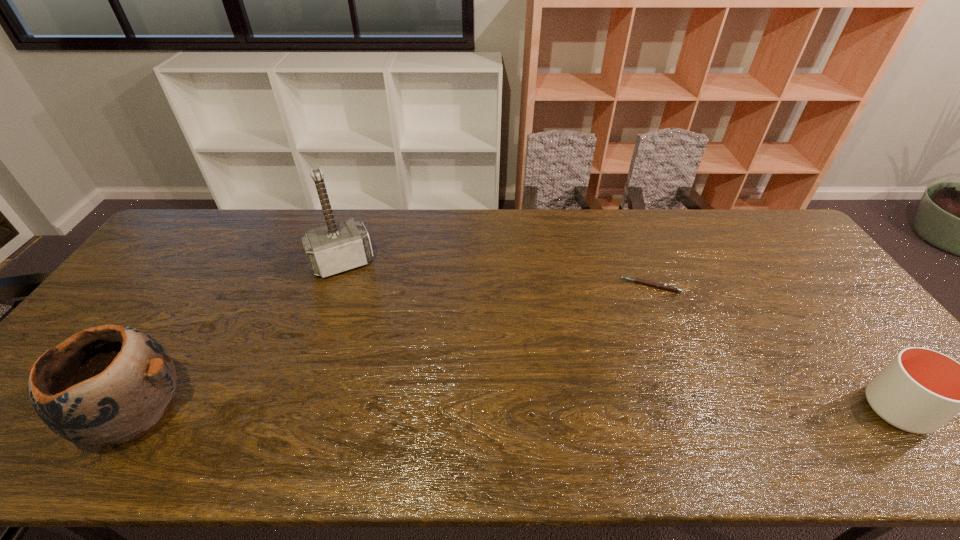
I want to click on free space between the third shortest object and the shortest object, so click(x=394, y=349).

The height and width of the screenshot is (540, 960). Find the location of `free area in between the hammer and the leftmost object`. free area in between the hammer and the leftmost object is located at coordinates (239, 338).

Find the location of a particular element. This screenshot has width=960, height=540. free space that is in between the pen and the pottery is located at coordinates (394, 349).

Find the location of a particular element. Image resolution: width=960 pixels, height=540 pixels. empty space that is in between the second object from right to left and the pottery is located at coordinates [394, 349].

You are a GUI agent. You are given a task and a screenshot of the screen. Output one action in this format:
    pyautogui.click(x=<x>, y=<y>)
    Task: Click on the vacant space in between the shortest object and the second object from left to right
    The image size is (960, 540).
    Given the screenshot: What is the action you would take?
    pyautogui.click(x=496, y=275)

At what (x,y) coordinates should I click in order to perform the action: click on free space between the third object from left to right and the leftmost object. Please return your answer as a coordinate pair (x, y). Image resolution: width=960 pixels, height=540 pixels. Looking at the image, I should click on (394, 349).

Where is `free spot between the leftmost object and the third object from right to left`? This screenshot has height=540, width=960. free spot between the leftmost object and the third object from right to left is located at coordinates (239, 338).

Where is `empty location between the rightmost object and the pen`? Image resolution: width=960 pixels, height=540 pixels. empty location between the rightmost object and the pen is located at coordinates 774,347.

Where is `object that stands as the closest to the hammer`? This screenshot has width=960, height=540. object that stands as the closest to the hammer is located at coordinates (112, 383).

The image size is (960, 540). I want to click on object identified as the closest to the third tallest object, so click(658, 285).